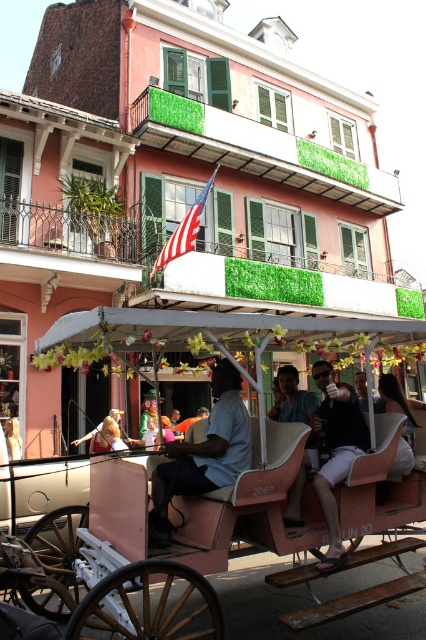
Question: Which point is farther to the camera?

Choices:
 (A) matte blue shirt at center
 (B) black matte shirt at center
 (C) pink matte horse cart at center

Answer: (B)

Question: Can you confirm if pink matte horse cart at center is wider than black matte shirt at center?

Choices:
 (A) no
 (B) yes

Answer: (A)

Question: Is matte blue shirt at center further to camera compared to black matte shirt at center?

Choices:
 (A) no
 (B) yes

Answer: (A)

Question: Does pink matte horse cart at center appear on the left side of black matte shirt at center?

Choices:
 (A) yes
 (B) no

Answer: (A)

Question: Which object appears closest to the camera in this image?

Choices:
 (A) matte blue shirt at center
 (B) pink matte horse cart at center

Answer: (A)

Question: Estimate the real-world distances between objects in this image. Which object is closer to the pink matte horse cart at center?

Choices:
 (A) matte blue shirt at center
 (B) black matte shirt at center

Answer: (A)